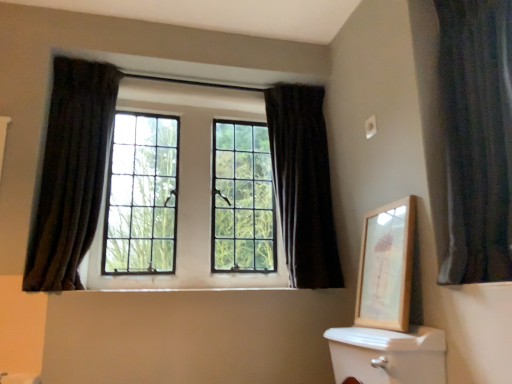
Locate an element on the screen. Image resolution: width=512 pixels, height=384 pixels. empty space that is ontop of dark velvet curtain at upper center, marked as the second curtain in a right-to-left arrangement (from a real-world perspective) is located at coordinates (292, 74).